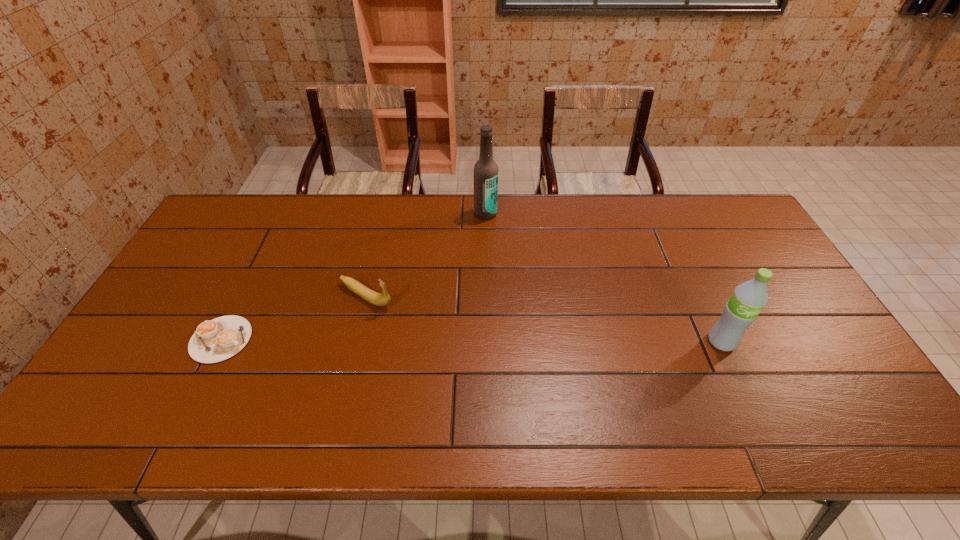
Where is `vacant space at the left edge of the desktop`? The height and width of the screenshot is (540, 960). vacant space at the left edge of the desktop is located at coordinates (157, 362).

In order to click on free space at the right edge of the desktop in this screenshot , I will do `click(819, 344)`.

In the image, there is a desktop. Where is `vacant space at the far left corner`? This screenshot has width=960, height=540. vacant space at the far left corner is located at coordinates (217, 214).

In the image, there is a desktop. What are the coordinates of `vacant space at the far right corner` in the screenshot? It's located at (744, 235).

This screenshot has width=960, height=540. In order to click on vacant space at the near right corner in this screenshot , I will do `click(839, 394)`.

This screenshot has width=960, height=540. In order to click on unoccupied position between the water bottle and the shortest object in this screenshot , I will do `click(471, 340)`.

Locate an element on the screen. Image resolution: width=960 pixels, height=540 pixels. free space between the leftmost object and the beer bottle is located at coordinates (353, 276).

This screenshot has width=960, height=540. Find the location of `free area in between the third tallest object and the water bottle`. free area in between the third tallest object and the water bottle is located at coordinates (543, 319).

You are a GUI agent. You are given a task and a screenshot of the screen. Output one action in this format:
    pyautogui.click(x=<x>, y=<y>)
    Task: Click on the vacant area that lies between the cappuccino and the third tallest object
    This screenshot has height=540, width=960.
    Given the screenshot: What is the action you would take?
    pyautogui.click(x=294, y=318)

You are a GUI agent. You are given a task and a screenshot of the screen. Output one action in this format:
    pyautogui.click(x=<x>, y=<y>)
    Task: Click on the free point between the third nearest object and the shortest object
    This screenshot has height=540, width=960.
    Given the screenshot: What is the action you would take?
    pyautogui.click(x=294, y=318)